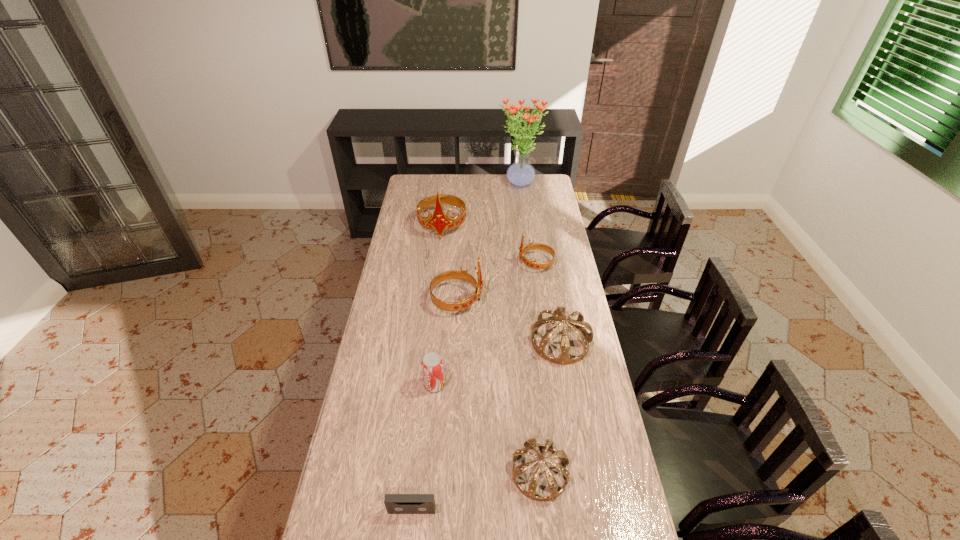
Image resolution: width=960 pixels, height=540 pixels. In order to click on vacant space that satisfies the following two spatial constraints: 1. on the front-facing side of the fourth nearest object; 2. on the right side of the rightmost red tiara in this screenshot , I will do `click(547, 342)`.

You are a GUI agent. You are given a task and a screenshot of the screen. Output one action in this format:
    pyautogui.click(x=<x>, y=<y>)
    Task: Click on the free spot that satisfies the following two spatial constraints: 1. on the logo side of the red soda can; 2. on the left side of the nearest tiara
    Image resolution: width=960 pixels, height=540 pixels.
    Given the screenshot: What is the action you would take?
    pyautogui.click(x=426, y=473)

Identify the location of vacant space that satisfies the following two spatial constraints: 1. on the front-facing side of the bigger brown tiara; 2. on the left side of the smallest red tiara. (547, 342).

Locate an element on the screen. vacant space that satisfies the following two spatial constraints: 1. on the front-facing side of the farthest tiara; 2. on the left side of the fourth nearest object is located at coordinates (429, 342).